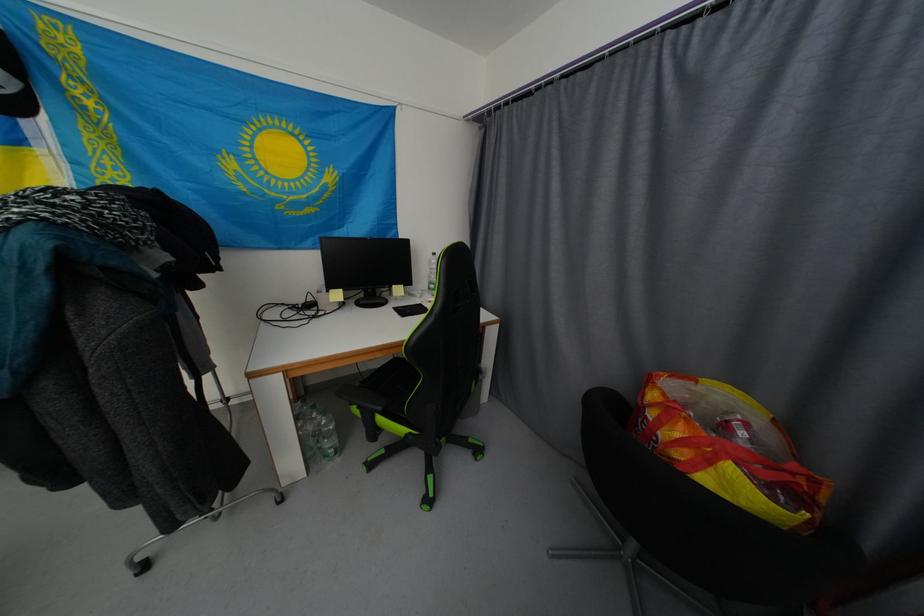
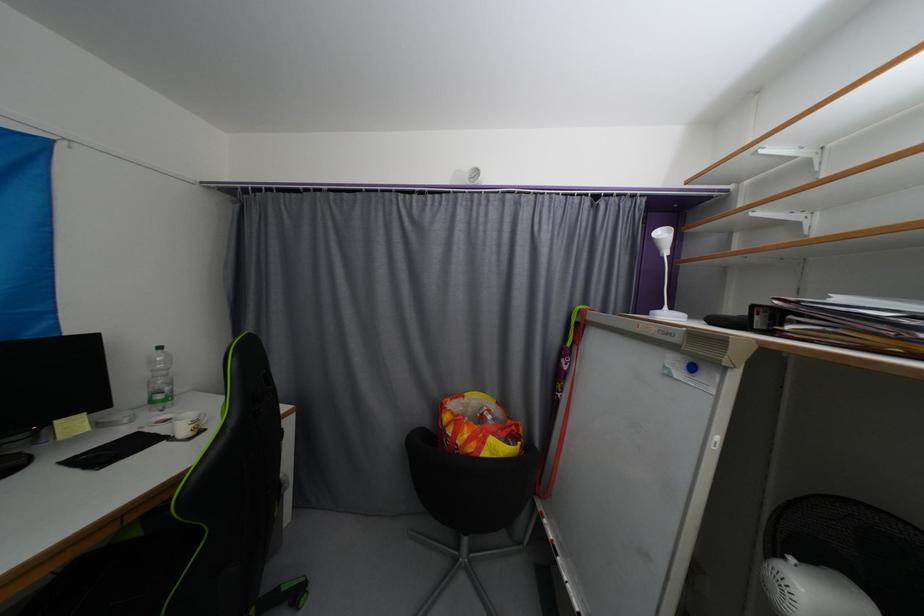
In the second image, find the point that corresponds to pixel 658 398 in the first image.

(452, 419)